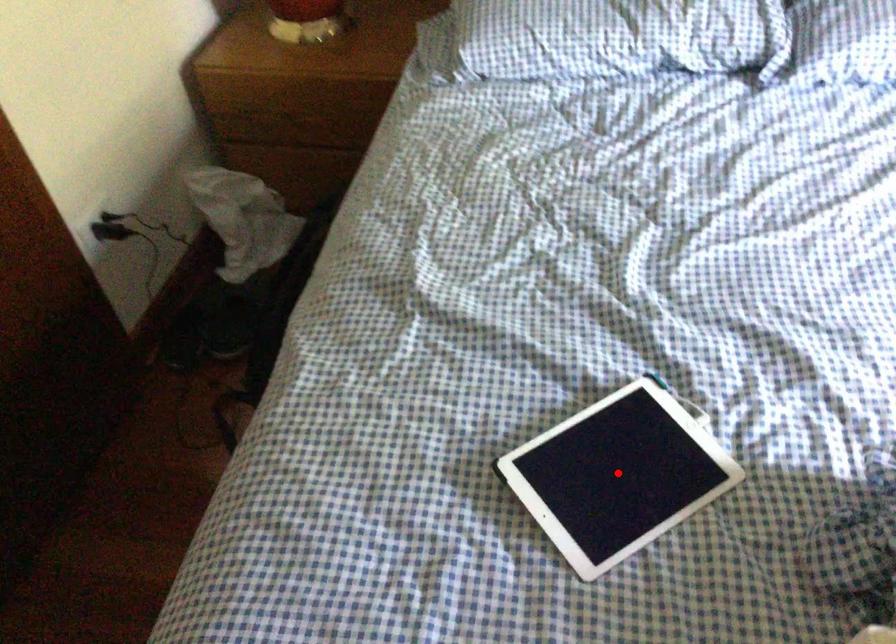
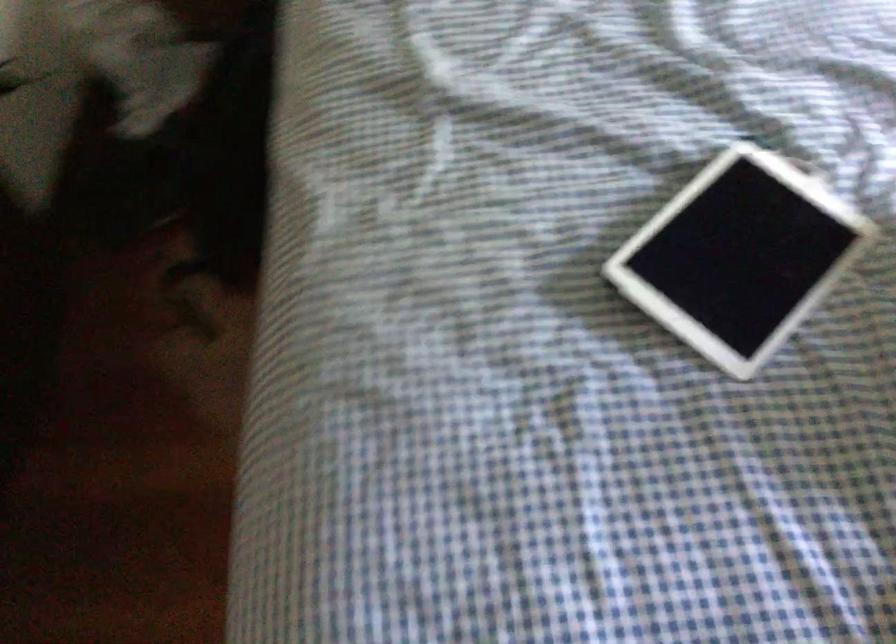
Locate, in the second image, the point that corresponds to the highlighted location in the first image.

(739, 256)